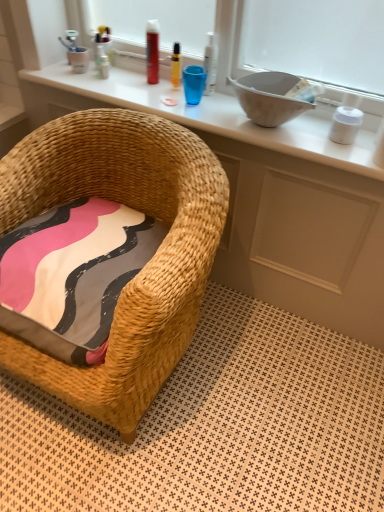
Question: In which direction should I rotate to look at white plastic bottle at upper center, the 2th toiletry when ordered from right to left?

Choices:
 (A) right
 (B) left

Answer: (A)

Question: Should I look upward or downward to see gray matte bowl at upper right?

Choices:
 (A) down
 (B) up

Answer: (B)

Question: Can you confirm if white plastic bottle at upper center, the 2th toiletry when ordered from right to left, is positioned to the right of white plastic bottle at upper center, placed as the 5th toiletry when sorted from right to left?

Choices:
 (A) no
 (B) yes

Answer: (B)

Question: Is white plastic bottle at upper center, the 2th toiletry when ordered from right to left, facing away from white plastic bottle at upper center, which ranks as the 1th toiletry in left-to-right order?

Choices:
 (A) no
 (B) yes

Answer: (A)

Question: From the image's perspective, does white plastic bottle at upper center, the fourth toiletry when ordered from left to right, appear lower than white plastic bottle at upper center, placed as the 5th toiletry when sorted from right to left?

Choices:
 (A) yes
 (B) no

Answer: (A)

Question: Does white plastic bottle at upper center, the fourth toiletry when ordered from left to right, come behind white plastic bottle at upper center, placed as the 5th toiletry when sorted from right to left?

Choices:
 (A) yes
 (B) no

Answer: (B)

Question: Is white plastic bottle at upper center, the fourth toiletry when ordered from left to right, bigger than white plastic bottle at upper center, which ranks as the 1th toiletry in left-to-right order?

Choices:
 (A) no
 (B) yes

Answer: (B)

Question: Is white plastic bottle at upper center, the 2th toiletry when ordered from right to left, facing towards white plastic bottle at upper center, which ranks as the 1th toiletry in left-to-right order?

Choices:
 (A) yes
 (B) no

Answer: (B)

Question: Is woven straw chair at lower left further to camera compared to white matte container at upper right, which appears as the 5th toiletry when viewed from the left?

Choices:
 (A) yes
 (B) no

Answer: (B)

Question: Is woven straw chair at lower left outside white matte container at upper right, which appears as the 5th toiletry when viewed from the left?

Choices:
 (A) no
 (B) yes

Answer: (B)

Question: Does woven straw chair at lower left turn towards white matte container at upper right, marked as the 1th toiletry in a right-to-left arrangement?

Choices:
 (A) no
 (B) yes

Answer: (A)

Question: Can you confirm if woven straw chair at lower left is bigger than white matte container at upper right, which appears as the 5th toiletry when viewed from the left?

Choices:
 (A) no
 (B) yes

Answer: (B)

Question: From the image's perspective, is woven straw chair at lower left beneath white matte container at upper right, marked as the 1th toiletry in a right-to-left arrangement?

Choices:
 (A) yes
 (B) no

Answer: (A)

Question: Does woven straw chair at lower left have a lesser height compared to white matte container at upper right, which appears as the 5th toiletry when viewed from the left?

Choices:
 (A) yes
 (B) no

Answer: (A)

Question: From a real-world perspective, does white matte container at upper right, marked as the 1th toiletry in a right-to-left arrangement, sit lower than woven wood changing table at upper center?

Choices:
 (A) yes
 (B) no

Answer: (B)